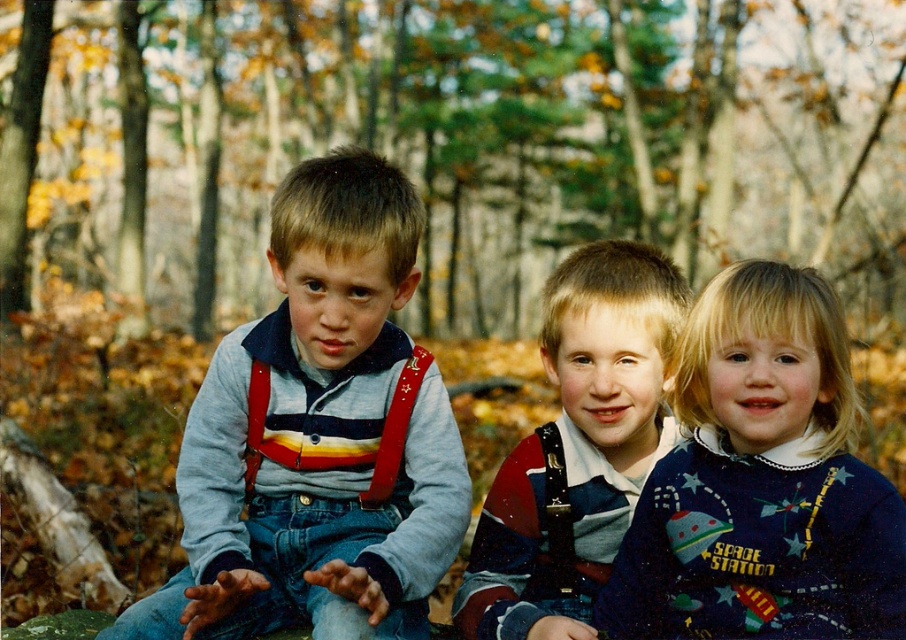
Question: Does matte gray sweater at center appear on the left side of space-themed sweater at center?

Choices:
 (A) no
 (B) yes

Answer: (B)

Question: Among these objects, which one is farthest from the camera?

Choices:
 (A) matte striped shirt at center
 (B) space-themed sweater at center

Answer: (A)

Question: Does matte gray sweater at center appear over space-themed sweater at center?

Choices:
 (A) no
 (B) yes

Answer: (B)

Question: Which point appears farthest from the camera in this image?

Choices:
 (A) (207, 396)
 (B) (651, 464)
 (C) (807, 317)

Answer: (B)

Question: Can you confirm if matte gray sweater at center is positioned to the right of matte striped shirt at center?

Choices:
 (A) yes
 (B) no

Answer: (B)

Question: Which object appears closest to the camera in this image?

Choices:
 (A) space-themed sweater at center
 (B) matte striped shirt at center

Answer: (A)